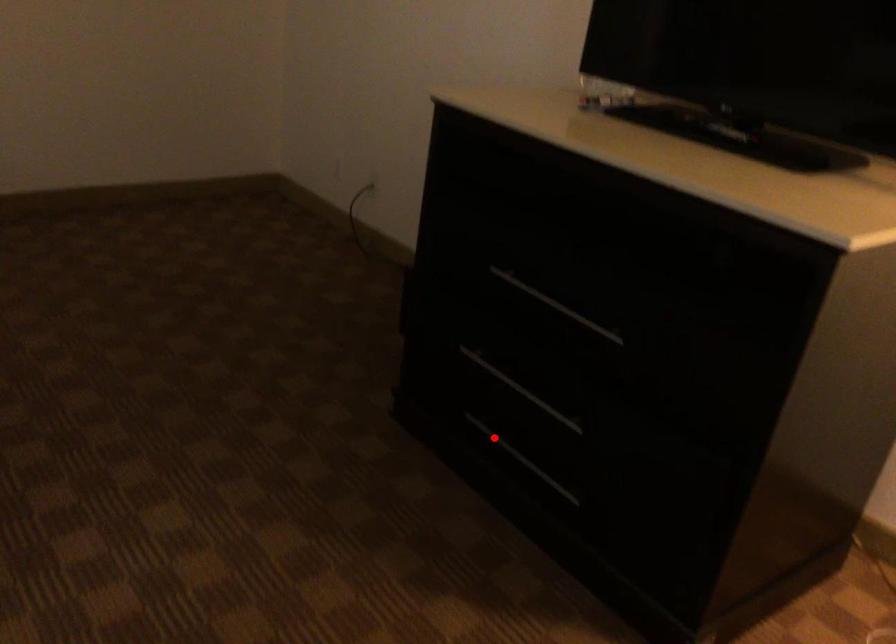
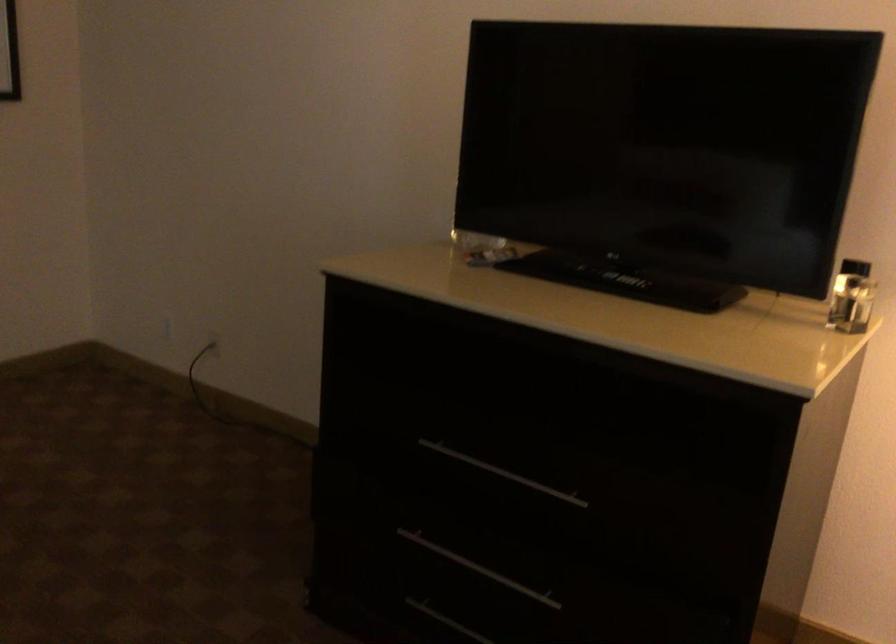
Find the pixel in the second image that matches the highlighted location in the first image.

(446, 621)